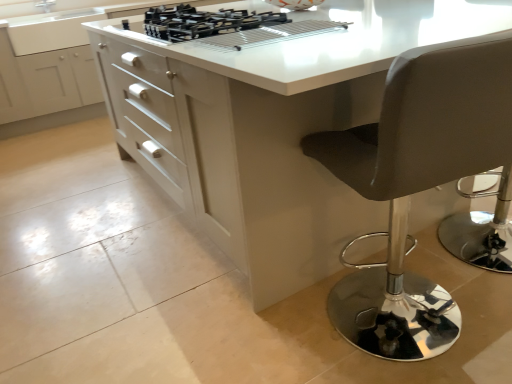
Question: Which is correct: leatherette stool at right is inside black matte gas stove at upper center, or outside of it?

Choices:
 (A) inside
 (B) outside

Answer: (B)

Question: Based on their sizes in the image, would you say leatherette stool at right is bigger or smaller than black matte gas stove at upper center?

Choices:
 (A) big
 (B) small

Answer: (A)

Question: Which is farther from the black matte gas stove at upper center?

Choices:
 (A) leatherette stool at right
 (B) white glossy table at center
 (C) white glossy cabinet at center

Answer: (C)

Question: Which object is the closest to the white glossy cabinet at center?

Choices:
 (A) white glossy table at center
 (B) black matte gas stove at upper center
 (C) leatherette stool at right

Answer: (B)